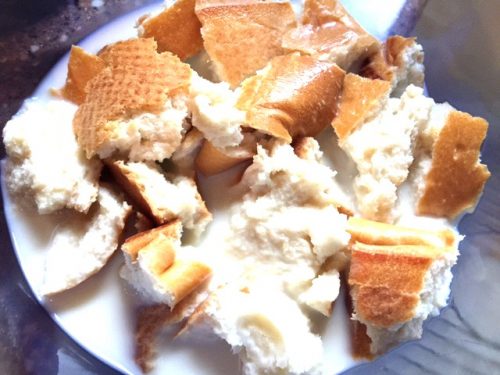
Locate an element on the screen. The width and height of the screenshot is (500, 375). surface is located at coordinates [x=459, y=323].